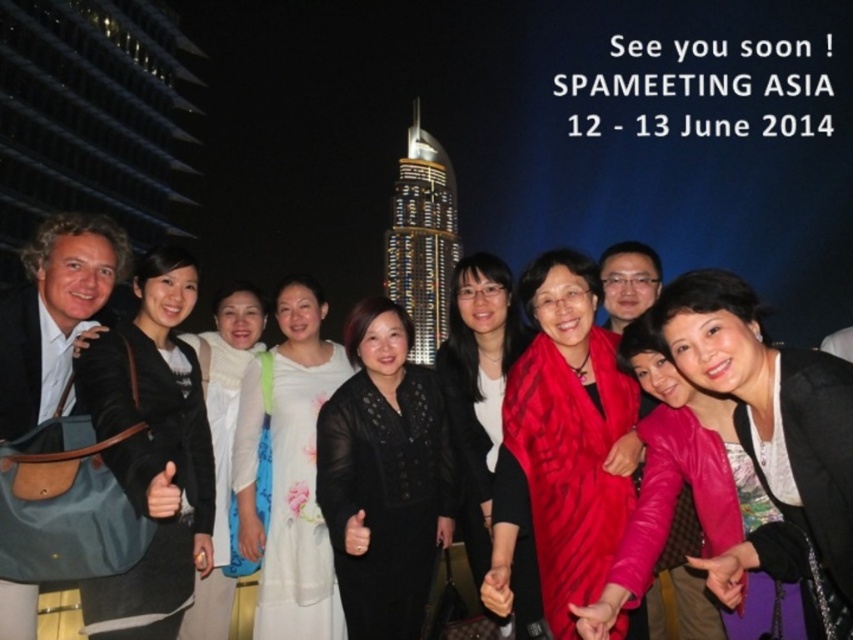
You are a photographer who wants to ensure the red silk scarf at center is visible in the final photo. Considering the camera frame has a resolution of 1920x1080 pixels, what are the pixel coordinates where the scarf is located?

The red silk scarf at center is located at point (563, 444). To convert this to pixel coordinates, multiply the x value by 1920 and the y value by 1080. The pixel coordinates are approximately x 1340 and y 713.

In the scene shown: You are a photographer trying to capture a close up of the black sheer dress at center. You are currently standing at the point with coordinates point (x=384, y=476). Is this point on the black sheer dress at center?

Yes, the point (x=384, y=476) is on the black sheer dress at center, so you are standing directly on the dress and can capture the close up.

You are a photographer trying to capture a closeup of the red silk scarf at center and the pink leather jacket at center. Based on their sizes, which one would require a wider angle lens to fully capture in the frame?

The red silk scarf at center might be wider than the pink leather jacket at center, so it would require a wider angle lens to fully capture in the frame.